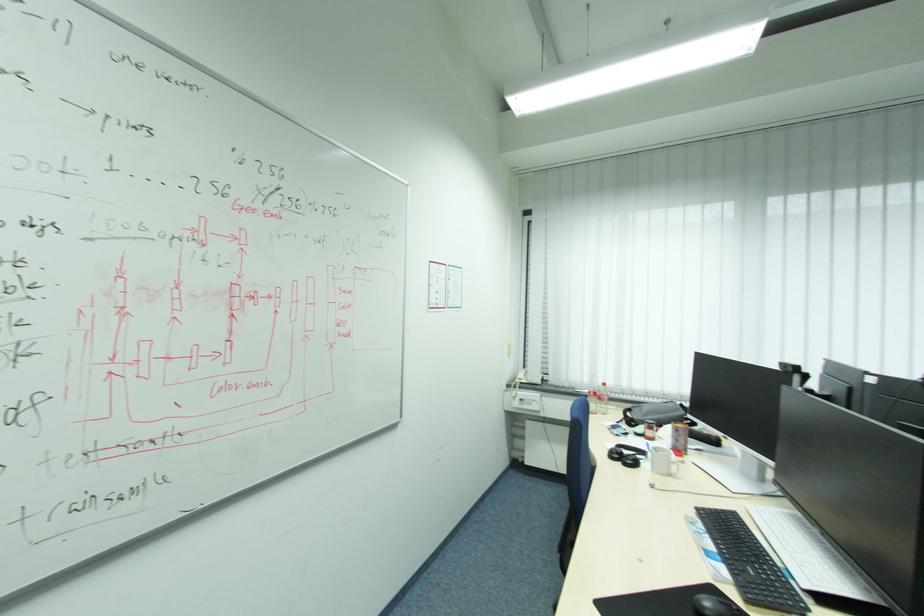
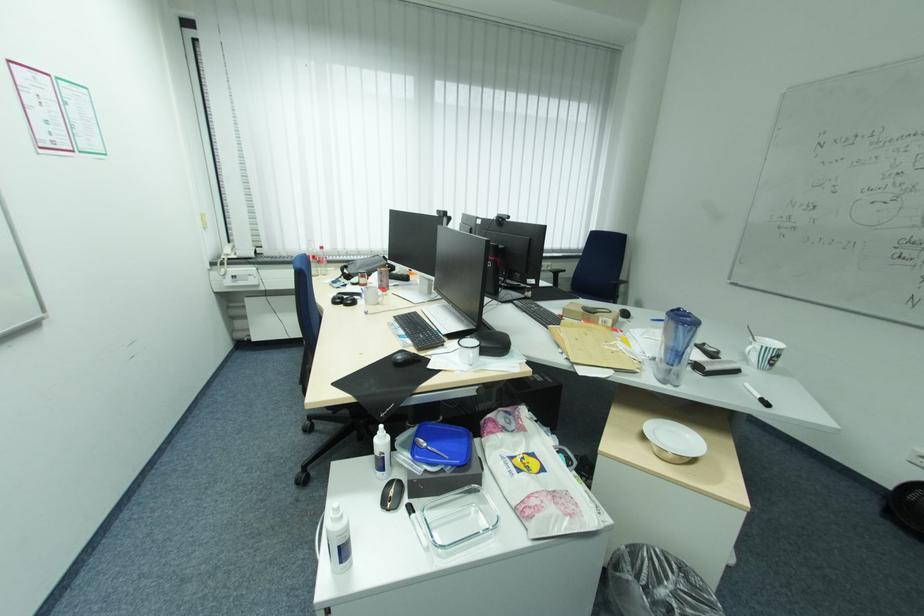
Where in the second image is the point corresponding to the point at 714,537 from the first image?

(407, 329)